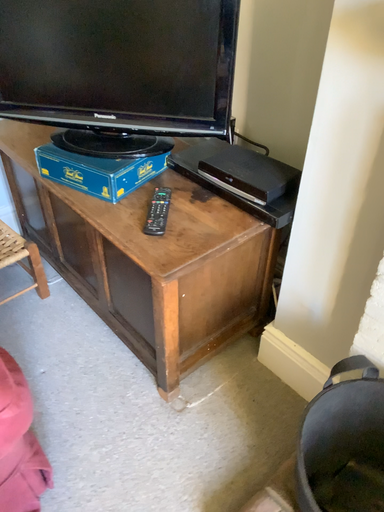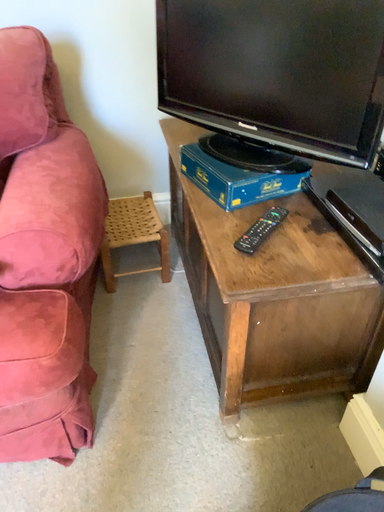
Question: Which way did the camera rotate in the video?

Choices:
 (A) rotated left
 (B) rotated right

Answer: (A)